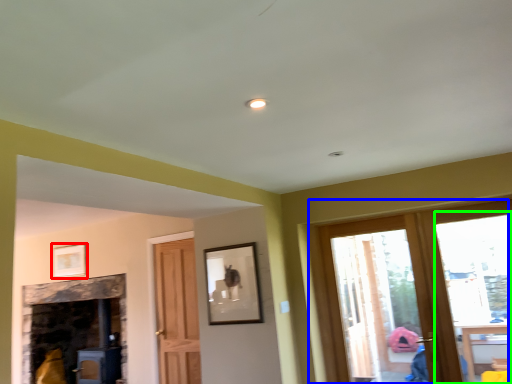
Question: Considering the real-world distances, which object is closest to picture frame (highlighted by a red box)? window (highlighted by a blue box) or window (highlighted by a green box).

Choices:
 (A) window
 (B) window

Answer: (A)